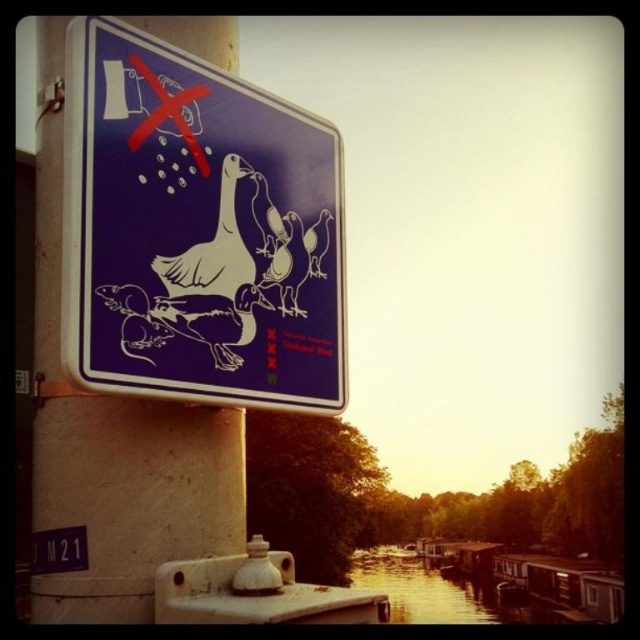
You are a tourist looking at the street sign and want to take a photo of both the matte blue sign at upper left and the blue plastic sign at upper left. Which one should you focus on first to ensure both are in clear view?

You should focus on the matte blue sign at upper left first because it is closer to you than the blue plastic sign at upper left. By focusing on the closer sign, both will be in clear view due to the depth of field.

From the picture: You are standing on the street looking at the sign. There are two points marked on the image. One is at coordinates point (42,116) and the other at point (67,538). Which point is closer to you?

Point (67,538) is closer to you because point (42,116) is behind it.

You are a city planner assessing the placement of the metallic pole at left and the blue plastic sign at upper left. Given that the minimum required distance between such signs and poles is 10 inches, is the current spacing compliant with regulations?

The metallic pole at left is 9.56 inches from the blue plastic sign at upper left. Since the required minimum distance is 10 inches, the current spacing is not compliant with regulations.